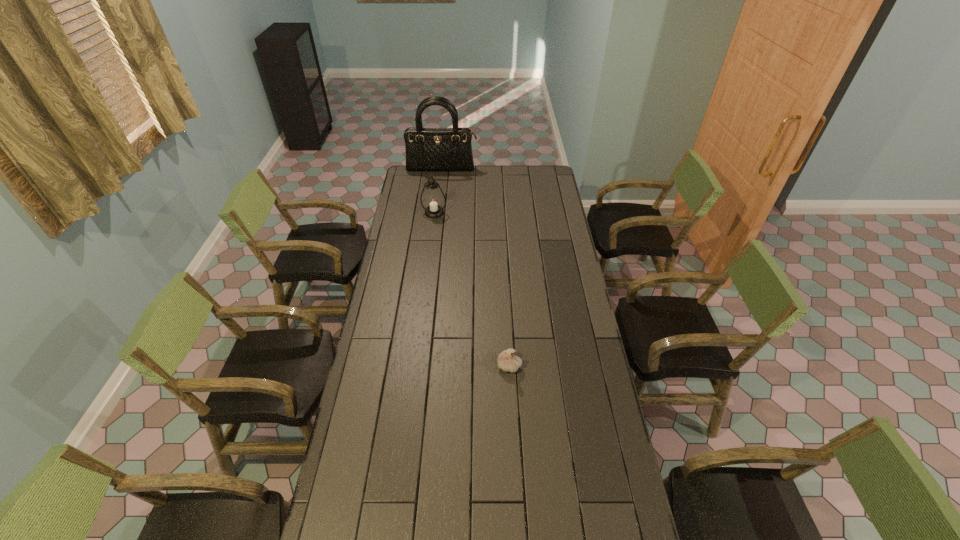
Where is `handbag located at the left edge`? handbag located at the left edge is located at coordinates (446, 149).

Identify the location of oil lamp that is positioned at the left edge. This screenshot has height=540, width=960. [x=433, y=200].

At what (x,y) coordinates should I click in order to perform the action: click on object that is positioned at the far left corner. Please return your answer as a coordinate pair (x, y). This screenshot has width=960, height=540. Looking at the image, I should click on (446, 149).

Find the location of a particular element. vacant space at the far edge is located at coordinates [434, 178].

Where is `vacant space at the left edge of the desktop`? Image resolution: width=960 pixels, height=540 pixels. vacant space at the left edge of the desktop is located at coordinates (400, 227).

This screenshot has height=540, width=960. Identify the location of vacant space at the right edge of the desktop. (550, 255).

Where is `vacant area that lies between the oil lamp and the nearest object`? The width and height of the screenshot is (960, 540). vacant area that lies between the oil lamp and the nearest object is located at coordinates (471, 289).

What are the coordinates of `vacant area between the shortest object and the second nearest object` in the screenshot? It's located at (471, 289).

I want to click on vacant space that is in between the oil lamp and the shortest object, so click(x=471, y=289).

This screenshot has height=540, width=960. I want to click on free spot between the oil lamp and the garlic, so click(471, 289).